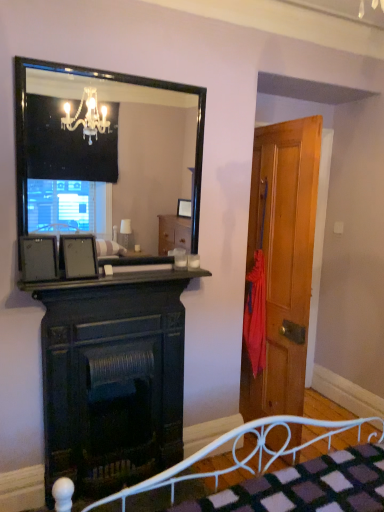
Question: From a real-world perspective, does wooden door at right stand above dark wood fireplace at center?

Choices:
 (A) no
 (B) yes

Answer: (B)

Question: Can we say wooden door at right lies outside dark wood fireplace at center?

Choices:
 (A) yes
 (B) no

Answer: (A)

Question: Is wooden door at right far from dark wood fireplace at center?

Choices:
 (A) no
 (B) yes

Answer: (A)

Question: Is wooden door at right positioned with its back to dark wood fireplace at center?

Choices:
 (A) no
 (B) yes

Answer: (B)

Question: From the image's perspective, is wooden door at right on top of dark wood fireplace at center?

Choices:
 (A) yes
 (B) no

Answer: (A)

Question: Considering the relative sizes of wooden door at right and dark wood fireplace at center in the image provided, is wooden door at right bigger than dark wood fireplace at center?

Choices:
 (A) no
 (B) yes

Answer: (B)

Question: Is matte black picture frame at left, the 1th picture frame viewed from the left, behind wooden door at right?

Choices:
 (A) yes
 (B) no

Answer: (B)

Question: Is matte black picture frame at left, the 1th picture frame viewed from the left, in front of wooden door at right?

Choices:
 (A) yes
 (B) no

Answer: (A)

Question: Considering the relative sizes of matte black picture frame at left, the 1th picture frame viewed from the left, and wooden door at right in the image provided, is matte black picture frame at left, the 1th picture frame viewed from the left, shorter than wooden door at right?

Choices:
 (A) yes
 (B) no

Answer: (A)

Question: Are matte black picture frame at left, arranged as the 2th picture frame when viewed from the right, and wooden door at right making contact?

Choices:
 (A) no
 (B) yes

Answer: (A)

Question: Considering the relative sizes of matte black picture frame at left, arranged as the 2th picture frame when viewed from the right, and wooden door at right in the image provided, is matte black picture frame at left, arranged as the 2th picture frame when viewed from the right, smaller than wooden door at right?

Choices:
 (A) no
 (B) yes

Answer: (B)

Question: Are matte black picture frame at left, the 1th picture frame viewed from the left, and wooden door at right far apart?

Choices:
 (A) yes
 (B) no

Answer: (A)

Question: Considering the relative sizes of matte black picture frame at left, arranged as the 2th picture frame when viewed from the right, and dark wood fireplace at center in the image provided, is matte black picture frame at left, arranged as the 2th picture frame when viewed from the right, smaller than dark wood fireplace at center?

Choices:
 (A) yes
 (B) no

Answer: (A)